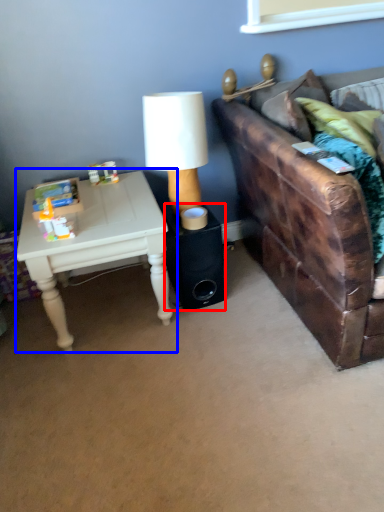
Question: Which of the following is the closest to the observer, speaker (highlighted by a red box) or table (highlighted by a blue box)?

Choices:
 (A) speaker
 (B) table

Answer: (B)